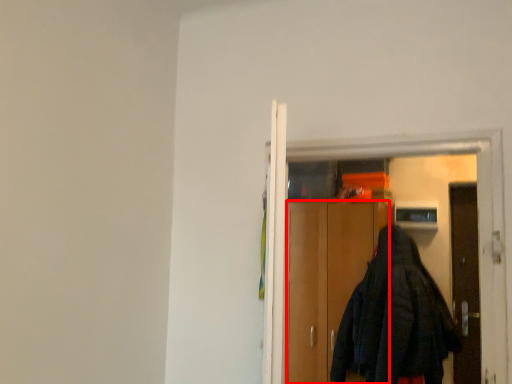
Question: From the image's perspective, where is cabinetry (annotated by the red box) located relative to elevator?

Choices:
 (A) above
 (B) below

Answer: (B)